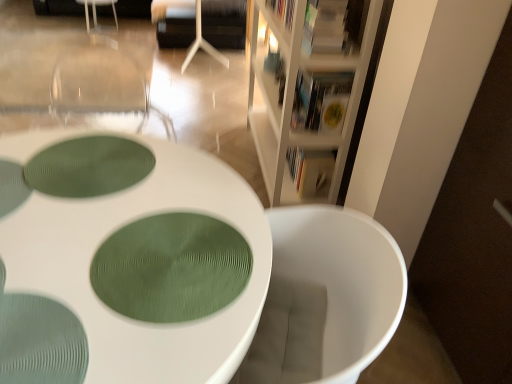
Question: Does white wood bookcase at upper right have a lesser height compared to hardcover book at upper center, the 2th book in the back-to-front sequence?

Choices:
 (A) no
 (B) yes

Answer: (A)

Question: Considering the relative sizes of white wood bookcase at upper right and hardcover book at upper center, the second book from the front, in the image provided, is white wood bookcase at upper right wider than hardcover book at upper center, the second book from the front,?

Choices:
 (A) no
 (B) yes

Answer: (B)

Question: Is white wood bookcase at upper right not inside hardcover book at upper center, the 2th book positioned from the bottom?

Choices:
 (A) no
 (B) yes

Answer: (B)

Question: Is white wood bookcase at upper right oriented towards hardcover book at upper center, the 2th book in the back-to-front sequence?

Choices:
 (A) yes
 (B) no

Answer: (A)

Question: Is white wood bookcase at upper right directly adjacent to hardcover book at upper center, the second book from the front?

Choices:
 (A) no
 (B) yes

Answer: (A)

Question: From their relative heights in the image, would you say hardcover book at upper center, the 2th book positioned from the bottom, is taller or shorter than white textured table at center?

Choices:
 (A) tall
 (B) short

Answer: (B)

Question: From the image's perspective, is hardcover book at upper center, the 2th book positioned from the bottom, positioned above or below white textured table at center?

Choices:
 (A) above
 (B) below

Answer: (A)

Question: Is point (325, 84) closer or farther from the camera than point (188, 344)?

Choices:
 (A) closer
 (B) farther

Answer: (B)

Question: From a real-world perspective, is hardcover book at upper center, the 2th book positioned from the bottom, physically located above or below white textured table at center?

Choices:
 (A) above
 (B) below

Answer: (A)

Question: Is hardcover book at upper center, the 2th book in the back-to-front sequence, in front of or behind white matte armchair at upper center in the image?

Choices:
 (A) front
 (B) behind

Answer: (A)

Question: From the image's perspective, is hardcover book at upper center, the second book from the front, located above or below white matte armchair at upper center?

Choices:
 (A) above
 (B) below

Answer: (B)

Question: Based on their sizes in the image, would you say hardcover book at upper center, the 2th book positioned from the bottom, is bigger or smaller than white matte armchair at upper center?

Choices:
 (A) small
 (B) big

Answer: (A)

Question: Which is correct: hardcover book at upper center, the second book from the front, is inside white matte armchair at upper center, or outside of it?

Choices:
 (A) inside
 (B) outside

Answer: (B)

Question: Is green textured placemat at center, the second oval when ordered from front to back, bigger or smaller than white textured table at center?

Choices:
 (A) big
 (B) small

Answer: (B)

Question: Is green textured placemat at center, placed as the 2th oval when sorted from bottom to top, wider or thinner than white textured table at center?

Choices:
 (A) wide
 (B) thin

Answer: (B)